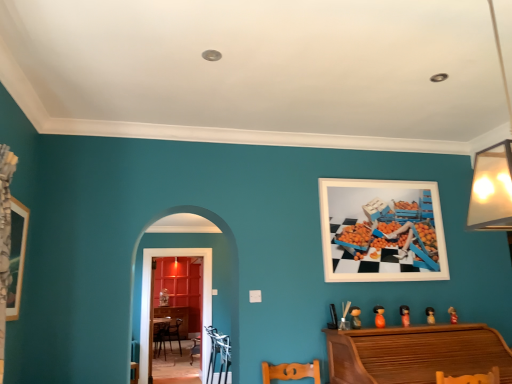
The image size is (512, 384). What are the coordinates of `free space in front of matte orange figurine at lower right, the 2th toy viewed from the right` in the screenshot? It's located at (431, 326).